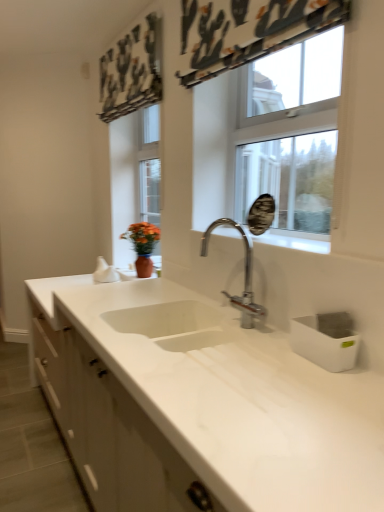
Question: Can you confirm if chrome metallic faucet at center is shorter than clear glass window at upper center?

Choices:
 (A) no
 (B) yes

Answer: (B)

Question: Does chrome metallic faucet at center have a greater width compared to clear glass window at upper center?

Choices:
 (A) yes
 (B) no

Answer: (A)

Question: Would you say chrome metallic faucet at center is a long distance from clear glass window at upper center?

Choices:
 (A) no
 (B) yes

Answer: (A)

Question: Can you confirm if chrome metallic faucet at center is bigger than clear glass window at upper center?

Choices:
 (A) yes
 (B) no

Answer: (B)

Question: Is chrome metallic faucet at center oriented towards clear glass window at upper center?

Choices:
 (A) no
 (B) yes

Answer: (A)

Question: Can you confirm if chrome metallic faucet at center is positioned to the left of clear glass window at upper center?

Choices:
 (A) yes
 (B) no

Answer: (A)

Question: Is clear glass window at upper center further to camera compared to chrome metallic faucet at center?

Choices:
 (A) no
 (B) yes

Answer: (B)

Question: Does clear glass window at upper center appear on the left side of chrome metallic faucet at center?

Choices:
 (A) no
 (B) yes

Answer: (A)

Question: Is clear glass window at upper center oriented towards chrome metallic faucet at center?

Choices:
 (A) no
 (B) yes

Answer: (B)

Question: Is clear glass window at upper center wider than chrome metallic faucet at center?

Choices:
 (A) no
 (B) yes

Answer: (A)

Question: Is clear glass window at upper center with chrome metallic faucet at center?

Choices:
 (A) no
 (B) yes

Answer: (A)

Question: Is clear glass window at upper center smaller than chrome metallic faucet at center?

Choices:
 (A) yes
 (B) no

Answer: (B)

Question: Is chrome metallic faucet at center bigger or smaller than clear glass window at upper center?

Choices:
 (A) big
 (B) small

Answer: (B)